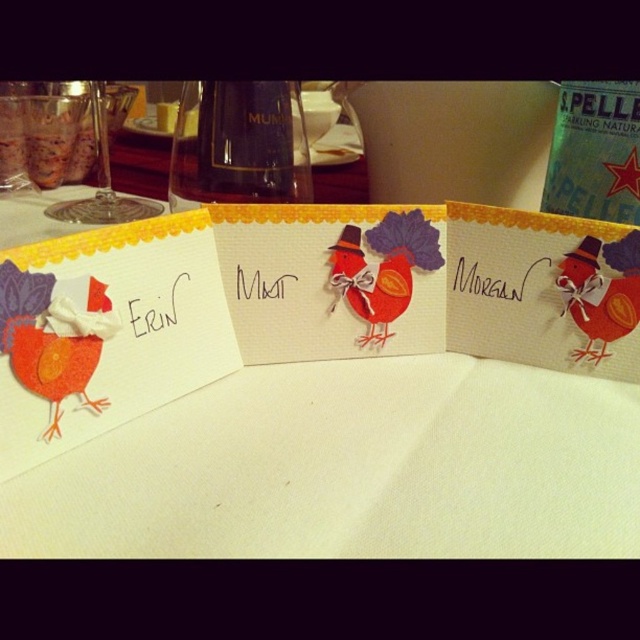
You are arranging place cards at a Thanksgiving table. You have a matte paper card at left. Where exactly should you place it on the table according to the coordinates provided?

The matte paper card at left should be placed at the coordinates point (106,332) as specified in the description.

You are setting up a Thanksgiving table and have two items to place on the tablecloth. You need to know which item has a greater width to ensure proper spacing. Which object is wider between the matte paper card at left and the matte orange paper chicken at right?

The matte paper card at left is wider than the matte orange paper chicken at right, so it has a greater width.